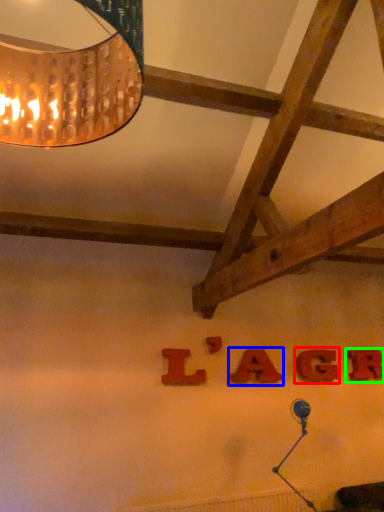
Question: Which object is the farthest from letter (highlighted by a red box)? Choose among these: letter (highlighted by a blue box) or letter (highlighted by a green box).

Choices:
 (A) letter
 (B) letter

Answer: (A)